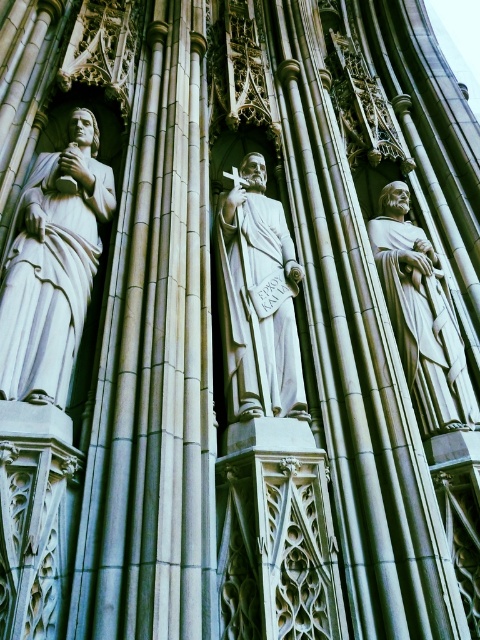
Can you confirm if white marble statue at left is shorter than white marble statue at center?

In fact, white marble statue at left may be taller than white marble statue at center.

Does white marble statue at left appear on the right side of white marble statue at center?

In fact, white marble statue at left is to the left of white marble statue at center.

This screenshot has height=640, width=480. What do you see at coordinates (52, 266) in the screenshot? I see `white marble statue at left` at bounding box center [52, 266].

In order to click on white marble statue at left in this screenshot , I will do `click(52, 266)`.

Consider the image. Who is more distant from viewer, (290,248) or (402,189)?

Point (402,189)

Can you confirm if white marble statue at center is wider than white marble statue at right?

No, white marble statue at center is not wider than white marble statue at right.

Which is behind, point (239, 403) or point (443, 397)?

The point (443, 397) is more distant.

The image size is (480, 640). What are the coordinates of `white marble statue at center` in the screenshot? It's located at (257, 300).

Which is in front, point (24, 342) or point (410, 266)?

Point (24, 342) is more forward.

Between white marble statue at left and white marble statue at right, which one appears on the left side from the viewer's perspective?

Positioned to the left is white marble statue at left.

Is point (47, 193) positioned behind point (462, 428)?

Yes, point (47, 193) is behind point (462, 428).

The image size is (480, 640). I want to click on white marble statue at left, so click(x=52, y=266).